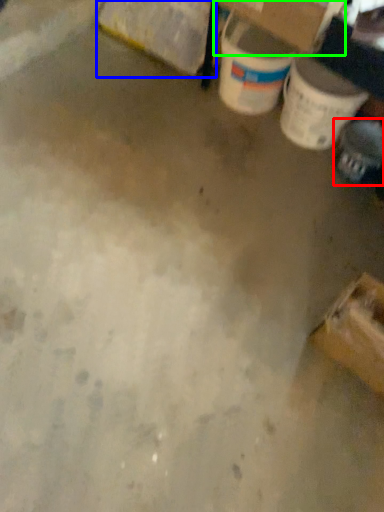
Question: Based on their relative distances, which object is nearer to footwear (highlighted by a red box)? Choose from cardboard box (highlighted by a blue box) and cardboard box (highlighted by a green box).

Choices:
 (A) cardboard box
 (B) cardboard box

Answer: (B)